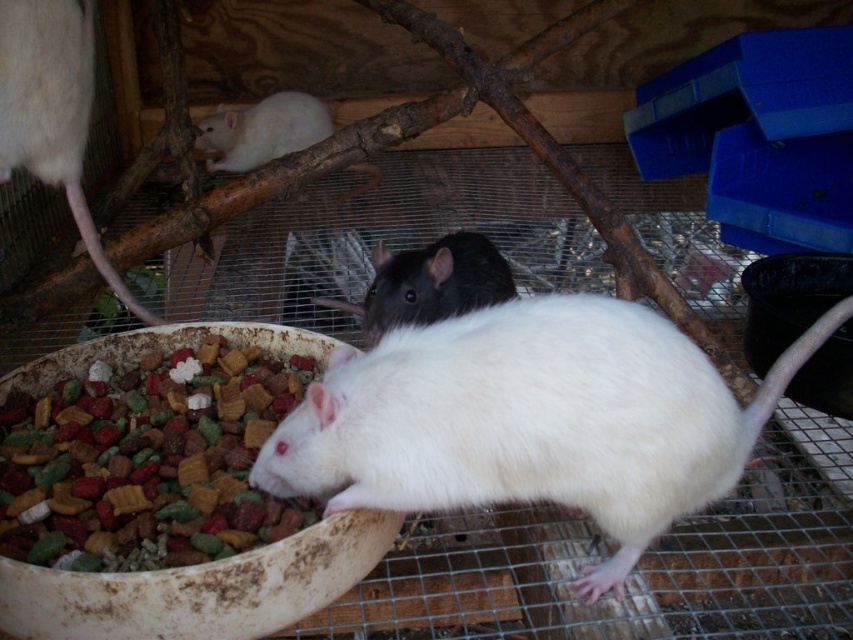
The width and height of the screenshot is (853, 640). What do you see at coordinates (531, 419) in the screenshot?
I see `white matte fur mouse at center` at bounding box center [531, 419].

Who is taller, white matte fur mouse at center or white matte fur at upper left?

Standing taller between the two is white matte fur at upper left.

Identify the location of white matte fur mouse at center. tap(531, 419).

This screenshot has width=853, height=640. Identify the location of white matte fur mouse at center. (531, 419).

Does colorful crunchy kibble at lower left have a lesser height compared to shiny black mouse at center?

No, colorful crunchy kibble at lower left is not shorter than shiny black mouse at center.

Which is more to the left, colorful crunchy kibble at lower left or shiny black mouse at center?

colorful crunchy kibble at lower left

Where is `colorful crunchy kibble at lower left`? This screenshot has height=640, width=853. colorful crunchy kibble at lower left is located at coordinates (148, 460).

From the picture: Does white matte fur mouse at center appear on the right side of colorful crunchy kibble at lower left?

Indeed, white matte fur mouse at center is positioned on the right side of colorful crunchy kibble at lower left.

Is white matte fur mouse at center above colorful crunchy kibble at lower left?

No, white matte fur mouse at center is not above colorful crunchy kibble at lower left.

Locate an element on the screen. Image resolution: width=853 pixels, height=640 pixels. white matte fur mouse at center is located at coordinates (531, 419).